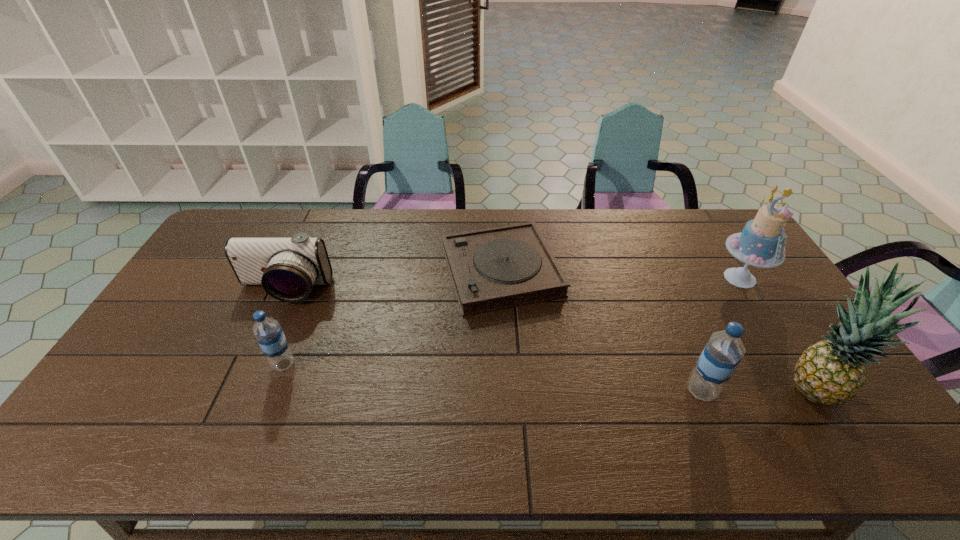
Locate an element on the screen. vacant space situated on the label of the fourth object from left to right is located at coordinates (813, 391).

Where is `vacant region located 0.150m with a ladder on the side of the second tallest object`? Image resolution: width=960 pixels, height=540 pixels. vacant region located 0.150m with a ladder on the side of the second tallest object is located at coordinates (775, 333).

Find the location of `vacant space located 0.180m on the surface of the camcorder`. vacant space located 0.180m on the surface of the camcorder is located at coordinates (255, 354).

At what (x,y) coordinates should I click in order to perform the action: click on blank space located on the front of the third object from left to right. Please return your answer as a coordinate pair (x, y). This screenshot has height=540, width=960. Looking at the image, I should click on (504, 330).

The width and height of the screenshot is (960, 540). I want to click on free space located 0.100m on the left of the pineapple, so click(744, 389).

Find the location of a particular element. This screenshot has height=540, width=960. object located in the far edge section of the desktop is located at coordinates (497, 268).

Find the location of `water bottle at the near edge`. water bottle at the near edge is located at coordinates (723, 352).

The width and height of the screenshot is (960, 540). Identify the location of pineapple that is at the near edge. (832, 372).

Where is `cake positioned at the right edge`? The width and height of the screenshot is (960, 540). cake positioned at the right edge is located at coordinates (761, 243).

You are a GUI agent. You are given a task and a screenshot of the screen. Output one action in this format:
    pyautogui.click(x=<x>, y=<y>)
    Task: Click on the pineapple present at the right edge
    This screenshot has height=540, width=960.
    Given the screenshot: What is the action you would take?
    pos(832,372)